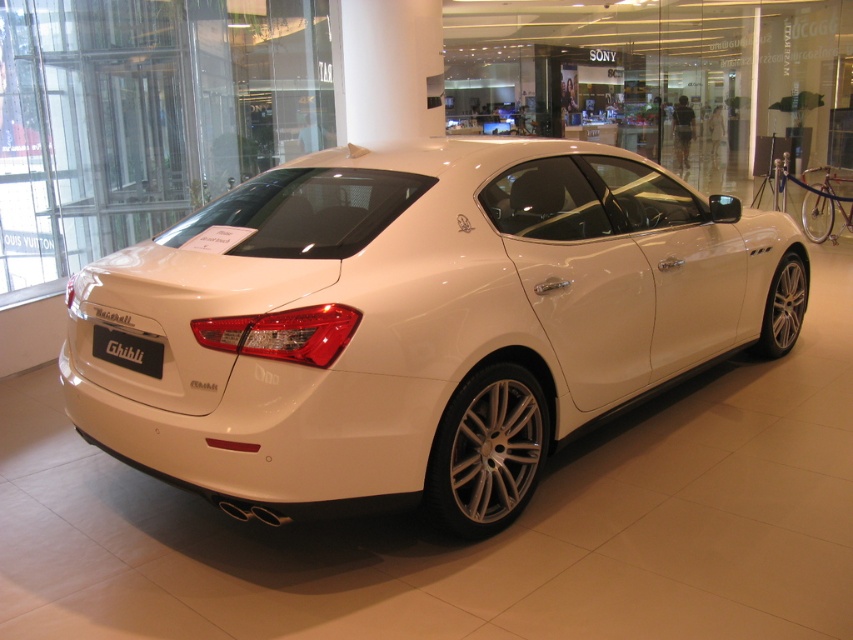
Question: Which point is closer to the camera taking this photo?

Choices:
 (A) (137, 337)
 (B) (746, 342)

Answer: (A)

Question: Is white metallic car at center closer to camera compared to black matte license plate at rear?

Choices:
 (A) yes
 (B) no

Answer: (A)

Question: Is white metallic car at center smaller than black matte license plate at rear?

Choices:
 (A) yes
 (B) no

Answer: (B)

Question: Which point is farther to the camera?

Choices:
 (A) (541, 317)
 (B) (134, 355)

Answer: (A)

Question: Does white metallic car at center appear on the right side of black matte license plate at rear?

Choices:
 (A) no
 (B) yes

Answer: (B)